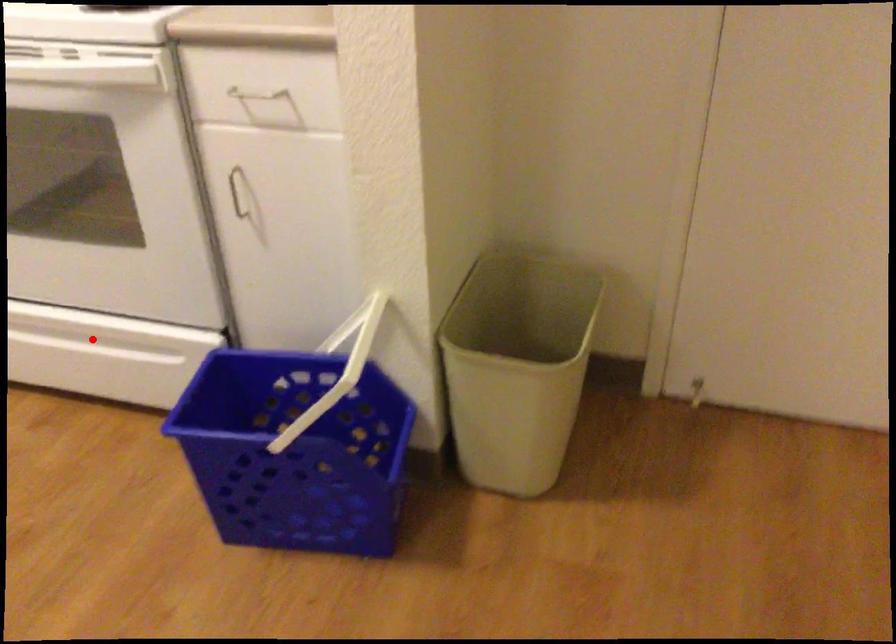
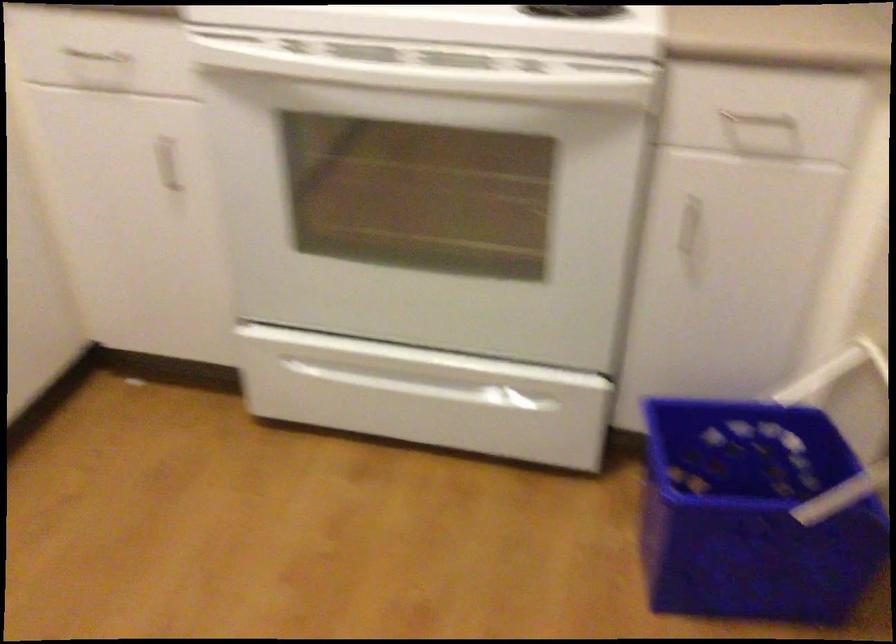
The point at the highlighted location is marked in the first image. Where is the corresponding point in the second image?

(435, 379)